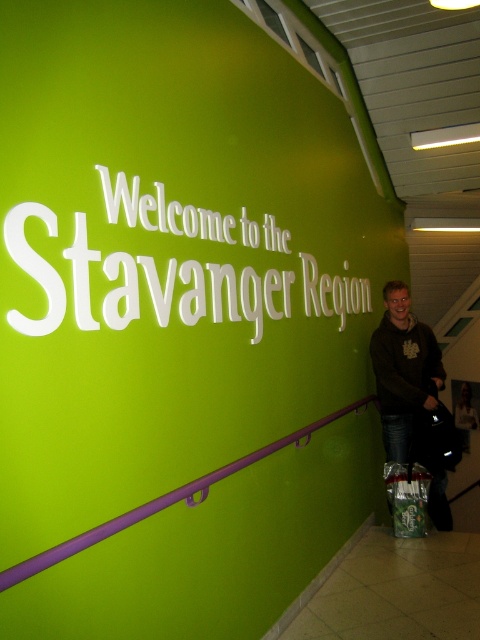
Question: Can you confirm if dark brown sweater at lower right is wider than smooth white shirt at center?

Choices:
 (A) no
 (B) yes

Answer: (B)

Question: Among these objects, which one is nearest to the camera?

Choices:
 (A) white matte sign at upper center
 (B) dark brown sweater at lower right
 (C) smooth white shirt at center

Answer: (A)

Question: Does white matte sign at upper center lie in front of smooth white shirt at center?

Choices:
 (A) yes
 (B) no

Answer: (A)

Question: Which of these objects is positioned closest to the dark brown sweater at lower right?

Choices:
 (A) smooth white shirt at center
 (B) white matte sign at upper center

Answer: (B)

Question: Is dark brown sweater at lower right to the left of smooth white shirt at center from the viewer's perspective?

Choices:
 (A) no
 (B) yes

Answer: (B)

Question: Estimate the real-world distances between objects in this image. Which object is closer to the dark brown sweater at lower right?

Choices:
 (A) smooth white shirt at center
 (B) white matte sign at upper center

Answer: (B)